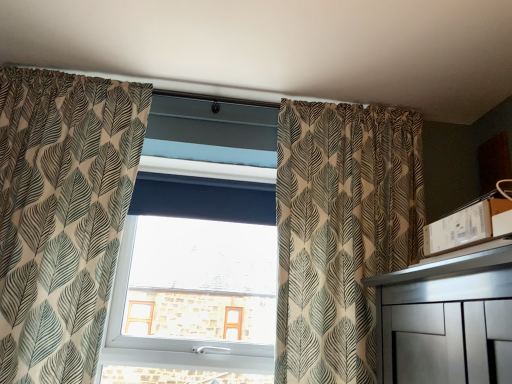
Question: Is patterned fabric curtain at center, acting as the first curtain starting from the right, outside transparent glass window at center?

Choices:
 (A) no
 (B) yes

Answer: (B)

Question: Can you confirm if patterned fabric curtain at center, acting as the first curtain starting from the right, is smaller than transparent glass window at center?

Choices:
 (A) yes
 (B) no

Answer: (B)

Question: Considering the relative sizes of patterned fabric curtain at center, acting as the first curtain starting from the right, and transparent glass window at center in the image provided, is patterned fabric curtain at center, acting as the first curtain starting from the right, thinner than transparent glass window at center?

Choices:
 (A) yes
 (B) no

Answer: (B)

Question: Considering the relative sizes of patterned fabric curtain at center, which is the second curtain from left to right, and transparent glass window at center in the image provided, is patterned fabric curtain at center, which is the second curtain from left to right, shorter than transparent glass window at center?

Choices:
 (A) no
 (B) yes

Answer: (A)

Question: Is the position of patterned fabric curtain at center, which is the second curtain from left to right, more distant than that of transparent glass window at center?

Choices:
 (A) no
 (B) yes

Answer: (A)

Question: From the image's perspective, would you say patterned fabric curtain at center, which is the second curtain from left to right, is shown under transparent glass window at center?

Choices:
 (A) no
 (B) yes

Answer: (A)

Question: From the image's perspective, is transparent glass window at center under patterned fabric curtain at center, acting as the first curtain starting from the right?

Choices:
 (A) no
 (B) yes

Answer: (B)

Question: Is transparent glass window at center facing towards patterned fabric curtain at center, which is the second curtain from left to right?

Choices:
 (A) yes
 (B) no

Answer: (B)

Question: Does transparent glass window at center lie in front of patterned fabric curtain at center, acting as the first curtain starting from the right?

Choices:
 (A) yes
 (B) no

Answer: (B)

Question: Would you say transparent glass window at center contains patterned fabric curtain at center, acting as the first curtain starting from the right?

Choices:
 (A) no
 (B) yes

Answer: (A)

Question: From a real-world perspective, is transparent glass window at center below patterned fabric curtain at center, acting as the first curtain starting from the right?

Choices:
 (A) yes
 (B) no

Answer: (A)

Question: Can you confirm if transparent glass window at center is shorter than patterned fabric curtain at center, which is the second curtain from left to right?

Choices:
 (A) no
 (B) yes

Answer: (B)

Question: From a real-world perspective, is patterned fabric curtain at left, which ranks as the 1th curtain in left-to-right order, located beneath patterned fabric curtain at center, acting as the first curtain starting from the right?

Choices:
 (A) no
 (B) yes

Answer: (B)